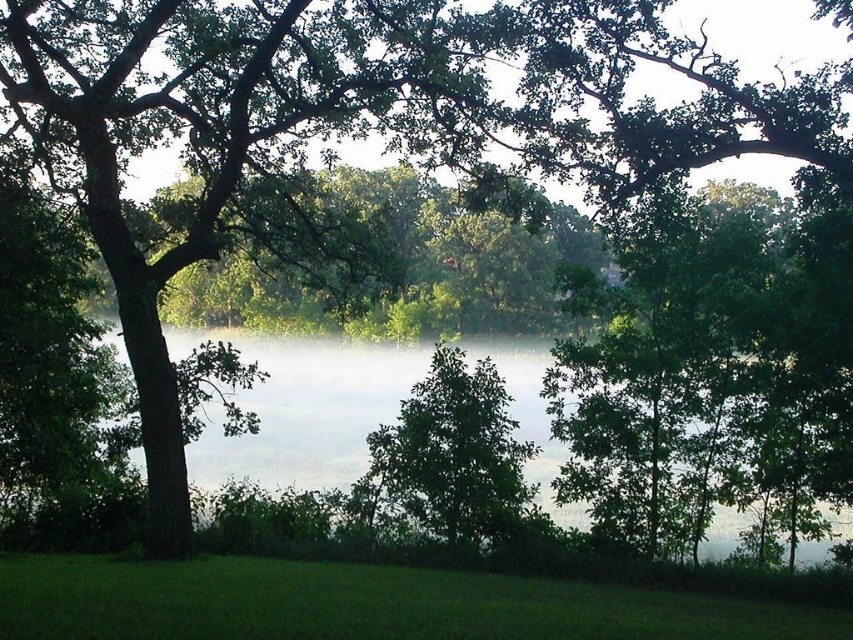
You are standing on the green lawn and see the misty water at center and the green leafy tree at center. Which object takes up more space in the image?

The misty water at center takes up more space in the image than the green leafy tree at center because it is bigger.

You are standing on the green lawn in the foreground and want to walk to the edge of the misty water at center. There is a green leafy tree at center blocking your path. Based on the scene description, can you determine if you can walk around the tree to reach the water?

The misty water at center has a larger width than the green leafy tree at center. This means the water is wider than the tree, so there might be space on either side of the tree to walk around it and reach the water.